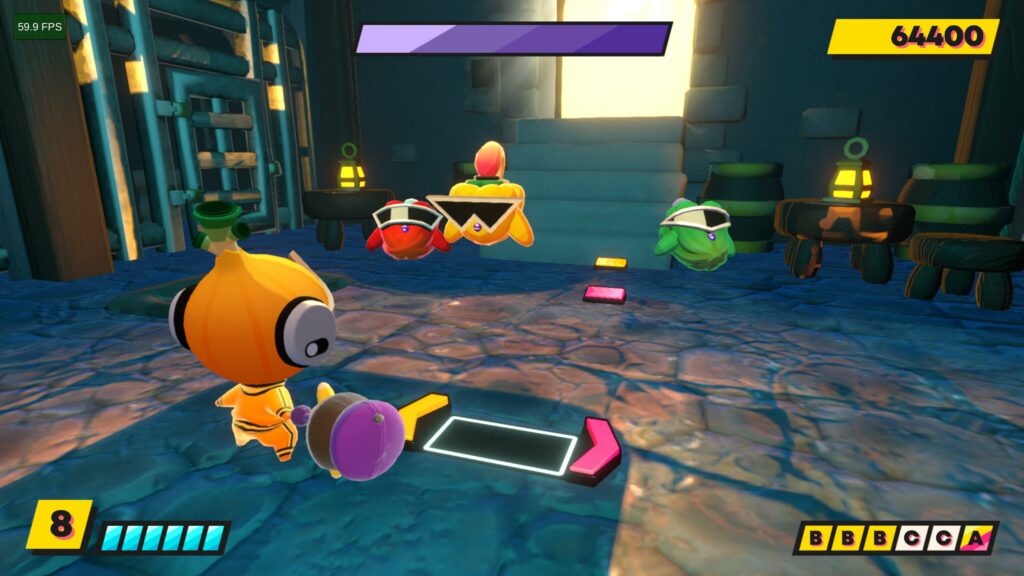
You are a GUI agent. You are given a task and a screenshot of the screen. Output one action in this format:
    pyautogui.click(x=<x>, y=<y>)
    Task: Click on the wooden stool
    This screenshot has width=1024, height=576.
    Given the screenshot: What is the action you would take?
    pyautogui.click(x=954, y=253)